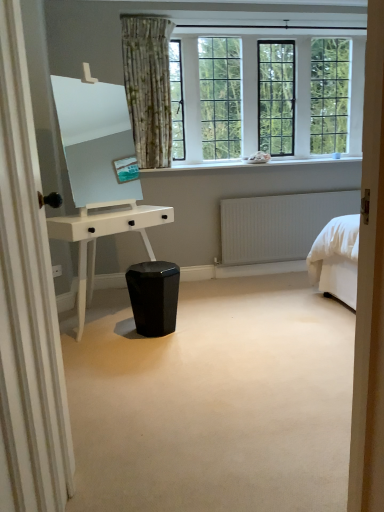
Measure the distance between point (203, 31) and camera.

Point (203, 31) and camera are 12.45 feet apart from each other.

Find the location of a particular element. The image size is (384, 512). white smooth window sill at upper center is located at coordinates (254, 164).

Find the location of a particular element. The width and height of the screenshot is (384, 512). white matte radiator at right is located at coordinates (x=279, y=224).

Where is `glossy black stool at center`? Image resolution: width=384 pixels, height=512 pixels. glossy black stool at center is located at coordinates (214, 401).

This screenshot has width=384, height=512. Describe the element at coordinates (101, 236) in the screenshot. I see `white glossy desk at center` at that location.

Where is `clear glass windows at upper center`? clear glass windows at upper center is located at coordinates (198, 89).

Can you confirm if floral fabric curtain at upper left is bigger than glossy black stool at center?

Incorrect, floral fabric curtain at upper left is not larger than glossy black stool at center.

Is the surface of floral fabric curtain at upper left in direct contact with glossy black stool at center?

floral fabric curtain at upper left and glossy black stool at center are not in contact.

In terms of width, does floral fabric curtain at upper left look wider or thinner when compared to glossy black stool at center?

Considering their sizes, floral fabric curtain at upper left looks slimmer than glossy black stool at center.

From a real-world perspective, which object stands above the other?

floral fabric curtain at upper left.

From the image's perspective, is floral fabric curtain at upper left located above or below white glossy desk at center?

floral fabric curtain at upper left is below white glossy desk at center.

Is floral fabric curtain at upper left wider than white glossy desk at center?

In fact, floral fabric curtain at upper left might be narrower than white glossy desk at center.

Can you confirm if floral fabric curtain at upper left is bigger than white glossy desk at center?

Incorrect, floral fabric curtain at upper left is not larger than white glossy desk at center.

From the image's perspective, is white smooth window sill at upper center beneath white matte radiator at right?

Actually, white smooth window sill at upper center appears above white matte radiator at right in the image.

Is white smooth window sill at upper center facing away from white matte radiator at right?

No, white smooth window sill at upper center's orientation is not away from white matte radiator at right.

Is white smooth window sill at upper center smaller than white matte radiator at right?

Actually, white smooth window sill at upper center might be larger than white matte radiator at right.

Which is behind, point (78, 265) or point (310, 202)?

Point (310, 202)

Which is more to the left, white glossy desk at center or white matte radiator at right?

From the viewer's perspective, white glossy desk at center appears more on the left side.

Would you say white glossy desk at center is a long distance from white matte radiator at right?

Indeed, white glossy desk at center is not near white matte radiator at right.

Is white smooth window sill at upper center aimed at white glossy desk at center?

No, white smooth window sill at upper center is not aimed at white glossy desk at center.

How many degrees apart are the facing directions of white smooth window sill at upper center and white glossy desk at center?

white smooth window sill at upper center and white glossy desk at center are facing 36 degrees away from each other.

Consider the image. Can you confirm if white smooth window sill at upper center is thinner than white glossy desk at center?

Yes.

Locate an element on the screen. This screenshot has height=512, width=384. window sill located on the right of white glossy desk at center is located at coordinates (254, 164).

What are the coordinates of `window sill on the right of the floral fabric curtain at upper left` in the screenshot? It's located at (254, 164).

Does point (252, 166) come farther from viewer compared to point (17, 303)?

Yes, it is.

From a real-world perspective, which object rests below the other?

From a 3D spatial view, floral fabric curtain at upper left is below.

Could you tell me if white smooth window sill at upper center is turned towards floral fabric curtain at upper left?

No.

Is glossy black stool at center directly adjacent to white smooth window sill at upper center?

No, glossy black stool at center is not making contact with white smooth window sill at upper center.

Which object is thinner, glossy black stool at center or white smooth window sill at upper center?

With smaller width is white smooth window sill at upper center.

Considering the positions of objects glossy black stool at center and white smooth window sill at upper center in the image provided, who is in front, glossy black stool at center or white smooth window sill at upper center?

glossy black stool at center is more forward.

Who is smaller, glossy black stool at center or white smooth window sill at upper center?

Smaller between the two is white smooth window sill at upper center.

Locate an element on the screen. The height and width of the screenshot is (512, 384). plain behind the floral fabric curtain at upper left is located at coordinates (214, 401).

Where is `curtain on the right of white glossy desk at center`? This screenshot has height=512, width=384. curtain on the right of white glossy desk at center is located at coordinates (27, 305).

Based on their spatial positions, is white smooth window sill at upper center or white glossy desk at center closer to glossy black stool at center?

white glossy desk at center is closer to glossy black stool at center.

From the image, which object appears to be nearer to white glossy desk at center, white smooth window sill at upper center or glossy black stool at center?

Among the two, glossy black stool at center is located nearer to white glossy desk at center.

Estimate the real-world distances between objects in this image. Which object is closer to white glossy desk at center, white smooth window sill at upper center or clear glass windows at upper center?

white smooth window sill at upper center is closer to white glossy desk at center.

Based on their spatial positions, is clear glass windows at upper center or floral fabric curtain at upper left closer to glossy black stool at center?

floral fabric curtain at upper left.

When comparing their distances from clear glass windows at upper center, does glossy black stool at center or floral fabric curtain at upper left seem further?

floral fabric curtain at upper left is positioned further to the anchor clear glass windows at upper center.

Based on their spatial positions, is white matte radiator at right or floral fabric curtain at upper left further from clear glass windows at upper center?

floral fabric curtain at upper left lies further to clear glass windows at upper center than the other object.

Based on the photo, estimate the real-world distances between objects in this image. Which object is further from white smooth window sill at upper center, white matte radiator at right or white glossy desk at center?

The object further to white smooth window sill at upper center is white glossy desk at center.

From the image, which object appears to be farther from floral fabric curtain at upper left, glossy black stool at center or white glossy desk at center?

white glossy desk at center is further to floral fabric curtain at upper left.

In order to click on desk positioned between glossy black stool at center and white smooth window sill at upper center from near to far in this screenshot , I will do `click(101, 236)`.

At what (x,y) coordinates should I click in order to perform the action: click on plain positioned between floral fabric curtain at upper left and white matte radiator at right from near to far. Please return your answer as a coordinate pair (x, y). Looking at the image, I should click on (214, 401).

At what (x,y) coordinates should I click in order to perform the action: click on plain located between floral fabric curtain at upper left and clear glass windows at upper center in the depth direction. Please return your answer as a coordinate pair (x, y). Looking at the image, I should click on (214, 401).

Where is `window located between glossy black stool at center and white matte radiator at right in the depth direction`? This screenshot has height=512, width=384. window located between glossy black stool at center and white matte radiator at right in the depth direction is located at coordinates (198, 89).